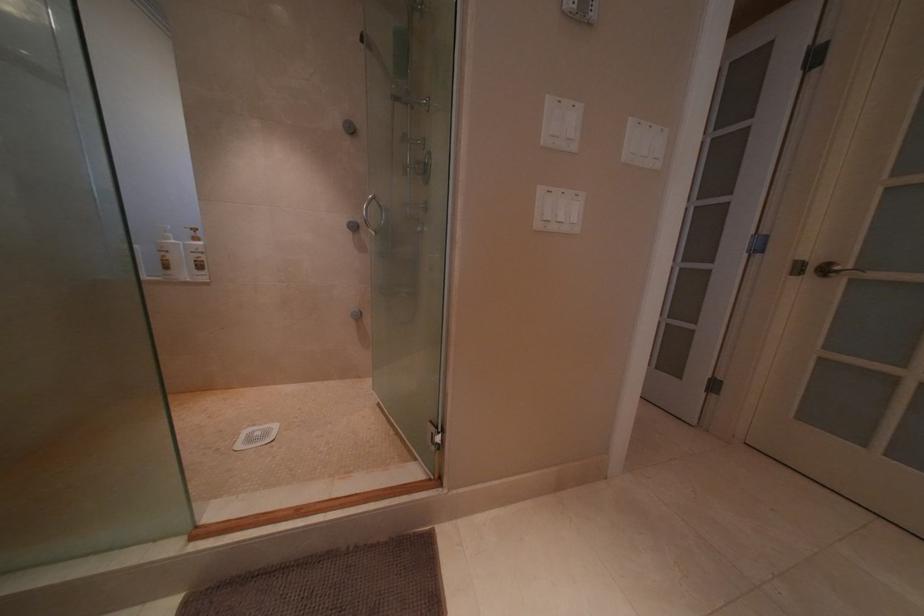
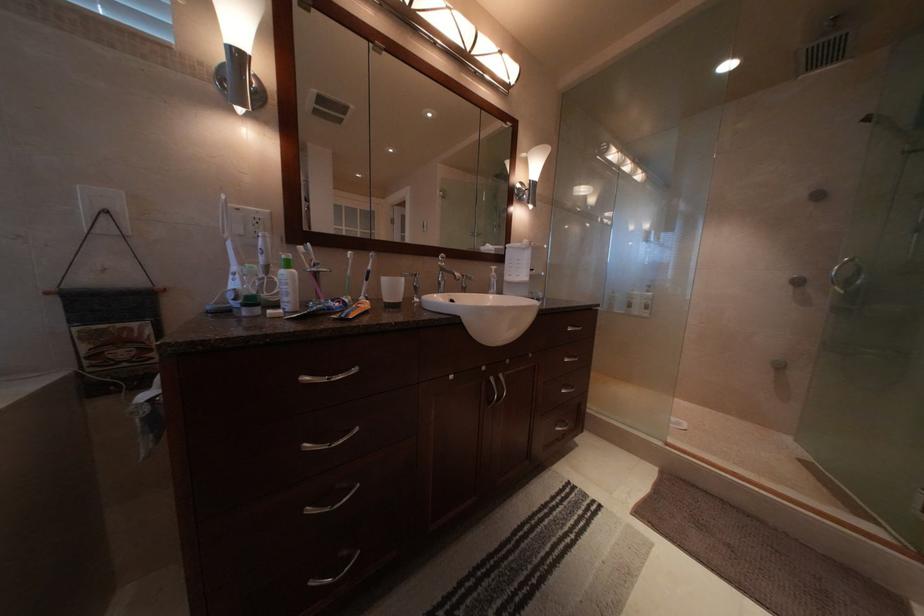
Question: The images are taken continuously from a first-person perspective. In which direction is your viewpoint rotating?

Choices:
 (A) Left
 (B) Right
 (C) Up
 (D) Down

Answer: (A)